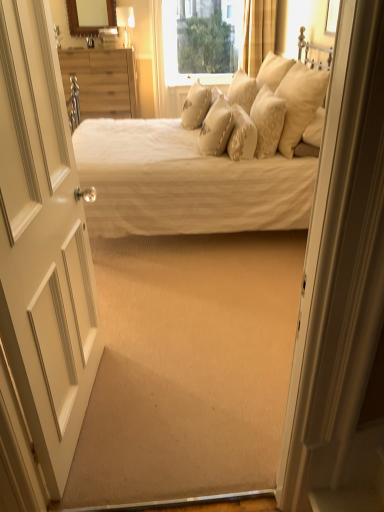
Question: Can you confirm if white textured bed at center is thinner than beige textured pillow at center, the second pillow when ordered from left to right?

Choices:
 (A) no
 (B) yes

Answer: (A)

Question: Is white textured bed at center oriented away from beige textured pillow at center, placed as the 5th pillow when sorted from right to left?

Choices:
 (A) no
 (B) yes

Answer: (B)

Question: Can you confirm if white textured bed at center is positioned to the right of beige textured pillow at center, the second pillow when ordered from left to right?

Choices:
 (A) no
 (B) yes

Answer: (A)

Question: Considering the relative sizes of white textured bed at center and beige textured pillow at center, placed as the 5th pillow when sorted from right to left, in the image provided, is white textured bed at center bigger than beige textured pillow at center, placed as the 5th pillow when sorted from right to left,?

Choices:
 (A) no
 (B) yes

Answer: (B)

Question: From a real-world perspective, is white textured bed at center physically below beige textured pillow at center, placed as the 5th pillow when sorted from right to left?

Choices:
 (A) yes
 (B) no

Answer: (A)

Question: Is wooden dresser at left wider or thinner than white wood door at left?

Choices:
 (A) thin
 (B) wide

Answer: (B)

Question: Is wooden dresser at left to the left or to the right of white wood door at left in the image?

Choices:
 (A) left
 (B) right

Answer: (A)

Question: From their relative heights in the image, would you say wooden dresser at left is taller or shorter than white wood door at left?

Choices:
 (A) tall
 (B) short

Answer: (B)

Question: Is wooden dresser at left inside the boundaries of white wood door at left, or outside?

Choices:
 (A) outside
 (B) inside

Answer: (A)

Question: From the image's perspective, relative to creamy beige fabric pillow at center, which is the 3th pillow from left to right, is white textured bed at center above or below?

Choices:
 (A) above
 (B) below

Answer: (A)

Question: From a real-world perspective, is white textured bed at center above or below creamy beige fabric pillow at center, arranged as the 4th pillow when viewed from the right?

Choices:
 (A) below
 (B) above

Answer: (A)

Question: Does point (292, 78) appear closer or farther from the camera than point (233, 104)?

Choices:
 (A) farther
 (B) closer

Answer: (B)

Question: In terms of size, does white textured bed at center appear bigger or smaller than creamy beige fabric pillow at center, arranged as the 4th pillow when viewed from the right?

Choices:
 (A) big
 (B) small

Answer: (A)

Question: Choose the correct answer: Is white wood door at left inside creamy satin pillow at upper center, which is counted as the 6th pillow, starting from the right, or outside it?

Choices:
 (A) outside
 (B) inside

Answer: (A)

Question: Considering their positions, is white wood door at left located in front of or behind creamy satin pillow at upper center, which is counted as the 6th pillow, starting from the right?

Choices:
 (A) front
 (B) behind

Answer: (A)